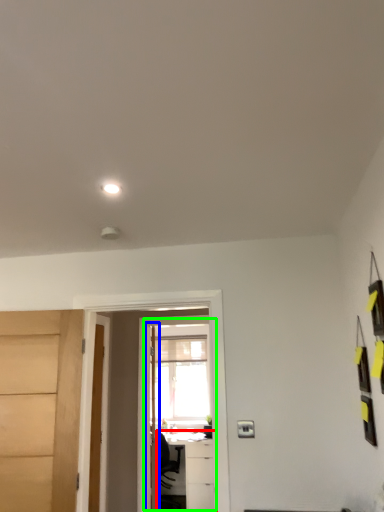
Question: Considering the real-world distances, which object is closest to table (highlighted by a red box)? door (highlighted by a blue box) or screen door (highlighted by a green box).

Choices:
 (A) door
 (B) screen door

Answer: (B)